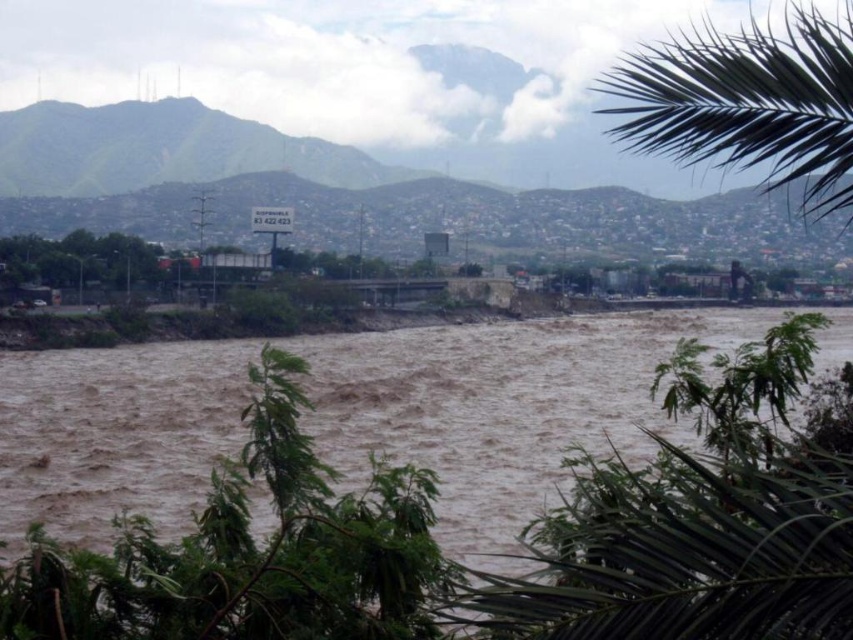
You are a hiker who wants to cross the flooded river. You see the brown muddy water at center and the green leafy mountain at upper left. Which direction should you head to avoid the deepest part of the river?

The brown muddy water at center is below the green leafy mountain at upper left. To avoid the deepest part of the river, you should head away from the brown muddy water at center towards higher ground near the green leafy mountain at upper left.

You are an environmental scientist analyzing the flood impact on the river ecosystem. You observe the green leafy palm at upper right and the green leafy mountain at upper left in the scene. Which of these two objects is taller?

The green leafy palm at upper right is taller than the green leafy mountain at upper left according to the description provided.